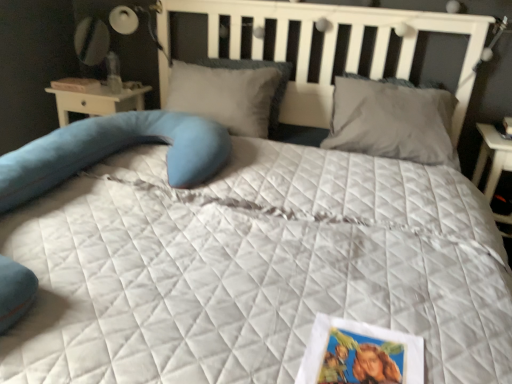
The image size is (512, 384). Find the location of `free point above printed paper postcard at lower right (from a real-world perspective)`. free point above printed paper postcard at lower right (from a real-world perspective) is located at coordinates (359, 353).